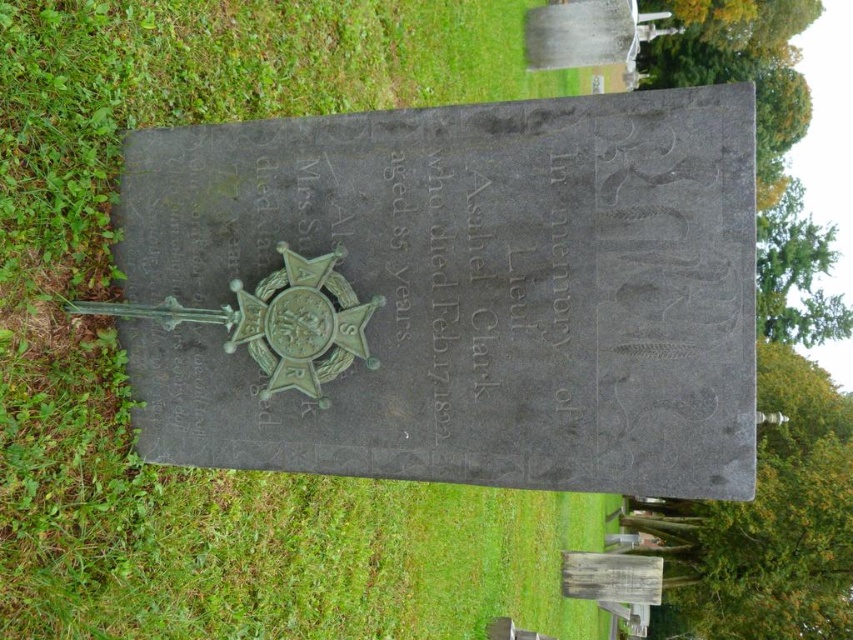
You are standing in a cemetery and see a green stone plaque at center and green grass at center. Which object is smaller?

The green stone plaque at center is smaller than the green grass at center.

You are designing a memorial layout and need to place a decorative border around both the green stone plaque at center and the green grass at center. Which object requires a wider border due to its larger size?

The green grass at center requires a wider border because its width is greater than the green stone plaque at center.

You are standing in a cemetery and see the green stone plaque at center and the green grass at center. Which object is nearer to you?

The green stone plaque at center is closer to the viewer than the green grass at center.